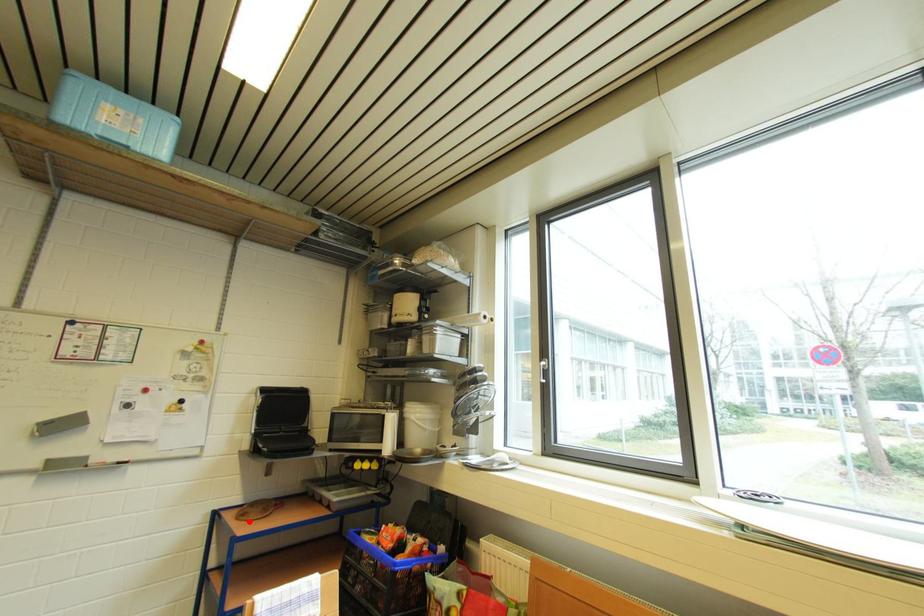
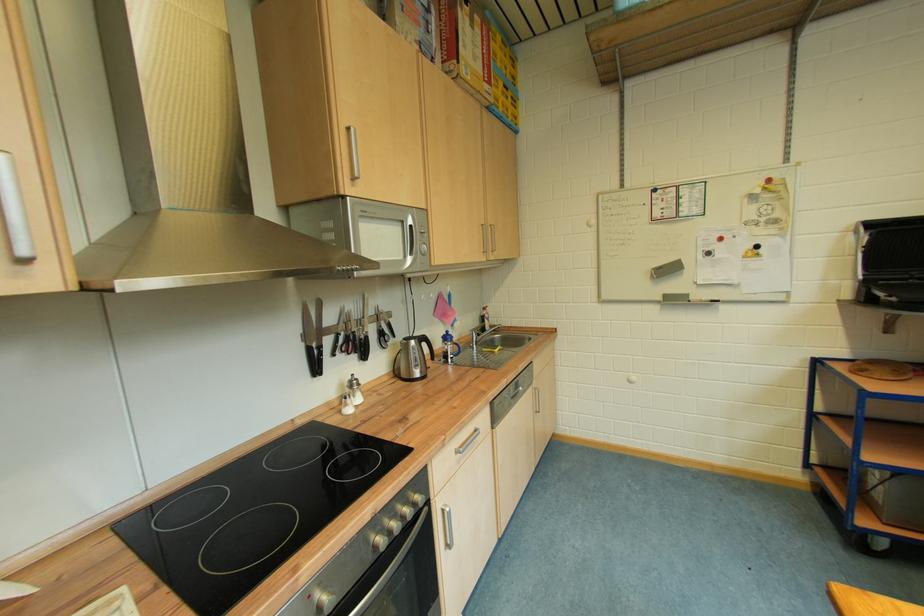
Where in the second image is the point corresponding to the highlighted location from the first image?

(868, 377)